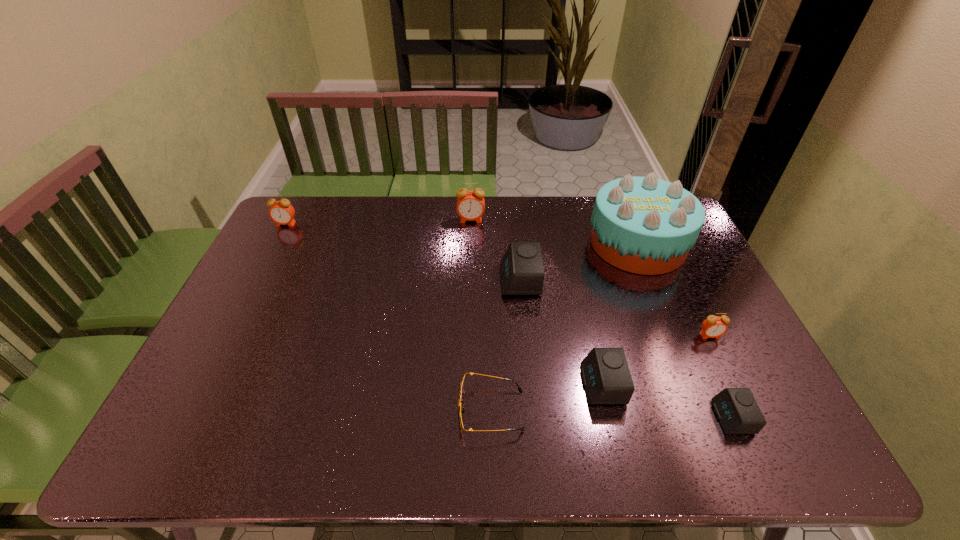
Find the location of `vacant space located 0.070m on the face of the fourth nearest object`. vacant space located 0.070m on the face of the fourth nearest object is located at coordinates 722,361.

This screenshot has width=960, height=540. Identify the location of blank space located 0.340m on the front-facing side of the fourth alarm clock from left to right. (446, 384).

The height and width of the screenshot is (540, 960). What are the coordinates of `free space located 0.370m on the front-facing side of the fourth alarm clock from left to right` in the screenshot? It's located at (434, 384).

The height and width of the screenshot is (540, 960). Identify the location of free space located on the front-facing side of the fourth alarm clock from left to right. (438, 384).

Locate an element on the screen. This screenshot has height=540, width=960. vacant space situated on the front-facing side of the rightmost black alarm clock is located at coordinates (618, 417).

Where is `free point located on the front-facing side of the rightmost black alarm clock`? free point located on the front-facing side of the rightmost black alarm clock is located at coordinates (627, 417).

The image size is (960, 540). Identify the location of vacant space situated on the front-facing side of the rightmost black alarm clock. (554, 417).

Locate an element on the screen. Image resolution: width=960 pixels, height=540 pixels. vacant space located on the front-facing side of the black sunglasses is located at coordinates (327, 410).

Find the location of a particular element. Image resolution: width=960 pixels, height=540 pixels. vacant space located on the front-facing side of the black sunglasses is located at coordinates (373, 410).

The image size is (960, 540). I want to click on vacant area situated 0.130m on the front-facing side of the black sunglasses, so click(x=403, y=410).